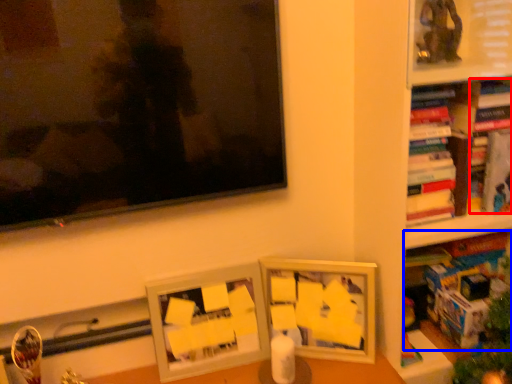
Question: Which of the following is the closest to the observer, book (highlighted by a red box) or book (highlighted by a blue box)?

Choices:
 (A) book
 (B) book

Answer: (B)